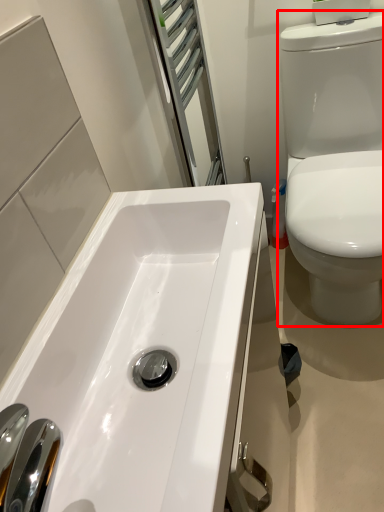
Question: Observing the image, what is the correct spatial positioning of toilet (annotated by the red box) in reference to sink?

Choices:
 (A) left
 (B) right

Answer: (B)